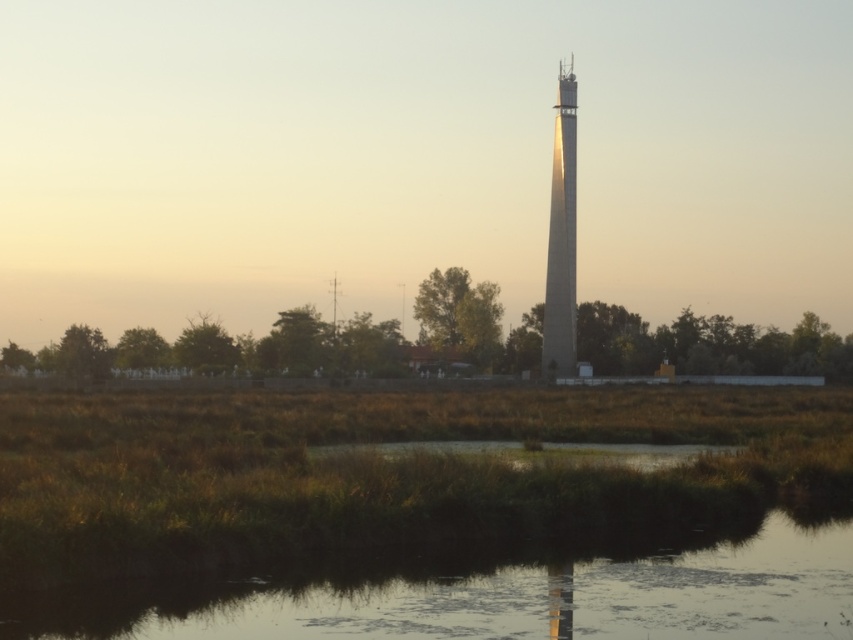
Question: Does transparent water at lower center appear on the left side of smooth concrete tower at center?

Choices:
 (A) no
 (B) yes

Answer: (B)

Question: Which object appears closest to the camera in this image?

Choices:
 (A) smooth concrete tower at center
 (B) transparent water at lower center

Answer: (B)

Question: Which point is farther from the camera taking this photo?

Choices:
 (A) (552, 285)
 (B) (515, 570)

Answer: (A)

Question: Is transparent water at lower center wider than smooth concrete tower at center?

Choices:
 (A) no
 (B) yes

Answer: (B)

Question: Can you confirm if transparent water at lower center is wider than smooth concrete tower at center?

Choices:
 (A) no
 (B) yes

Answer: (B)